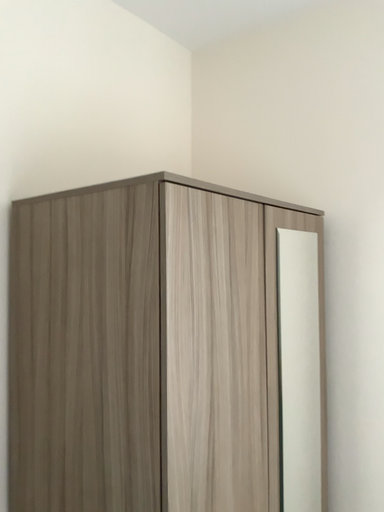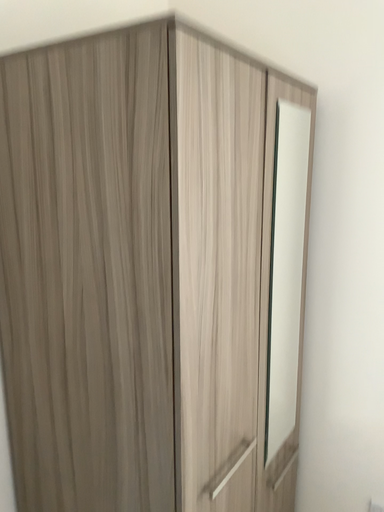
Question: Which way did the camera rotate in the video?

Choices:
 (A) rotated left
 (B) rotated right

Answer: (B)